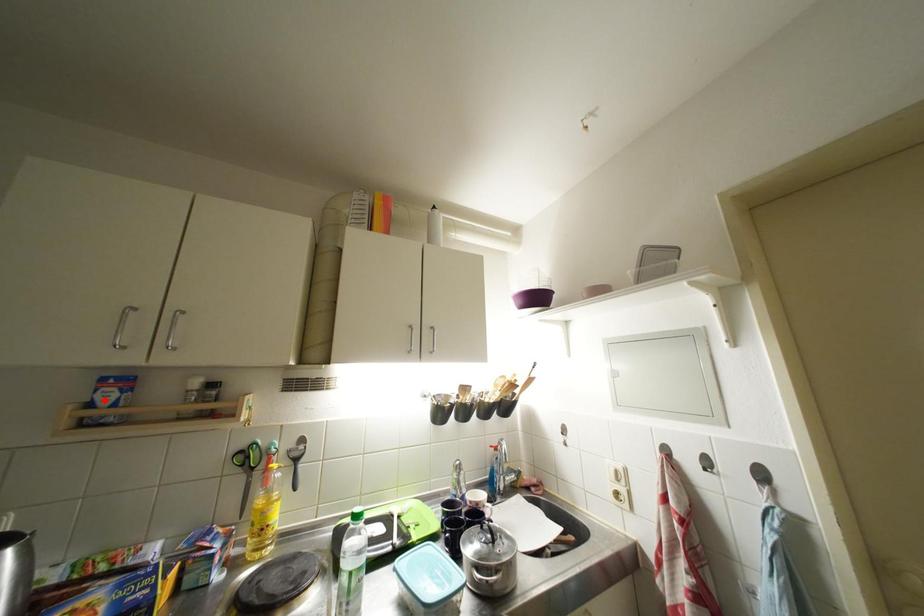
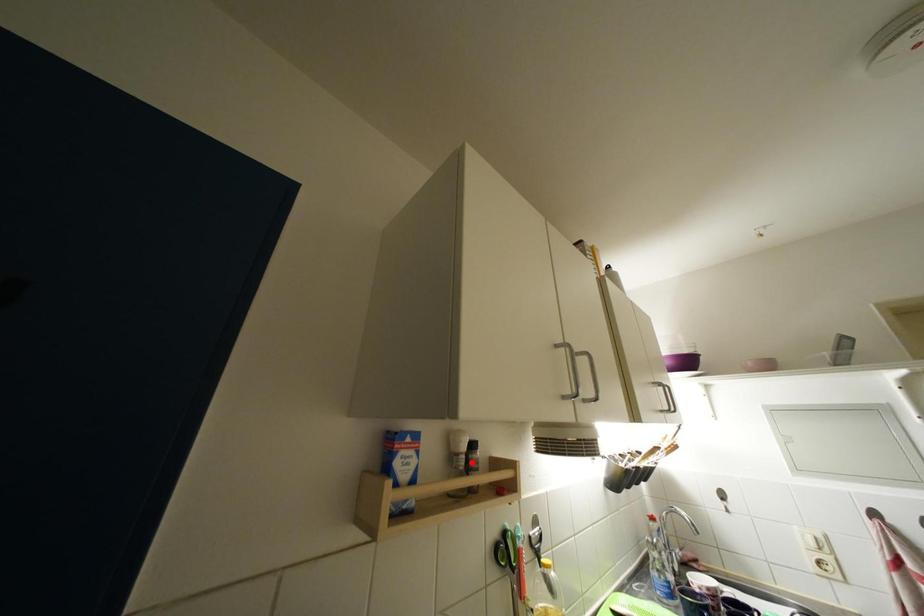
I am providing you with two images of the same scene from different viewpoints. A red point is marked on the first image and another point is marked on the second image. Are the points marked in image1 and image2 representing the same 3D position?

No